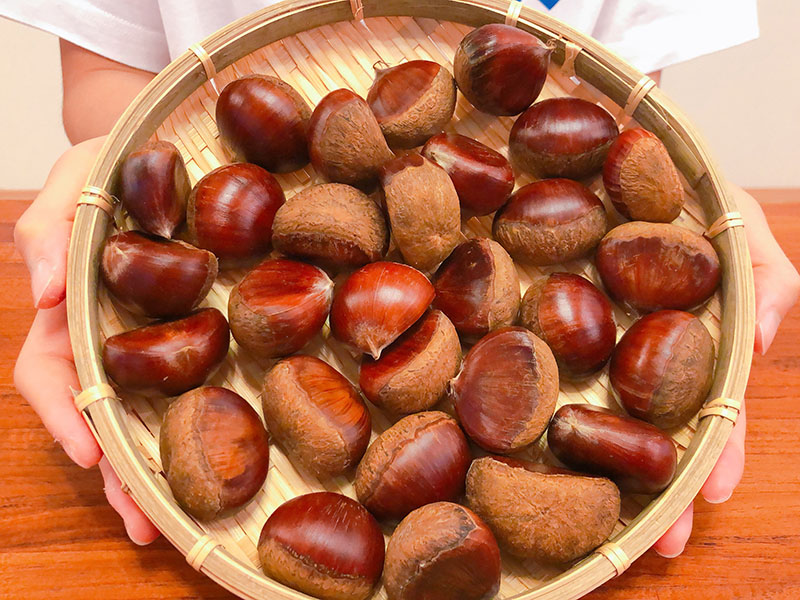
Locate an element on the screen. The image size is (800, 600). basket is located at coordinates (361, 53).